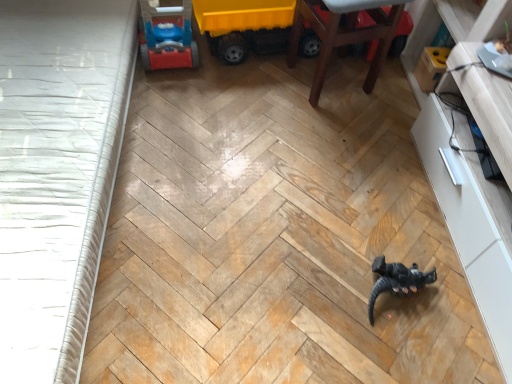
At what (x,y) coordinates should I click in order to perform the action: click on free space to the back side of black matte dinosaur at center, the 1th toy when ordered from right to left. Please return your answer as a coordinate pair (x, y). Looking at the image, I should click on (393, 231).